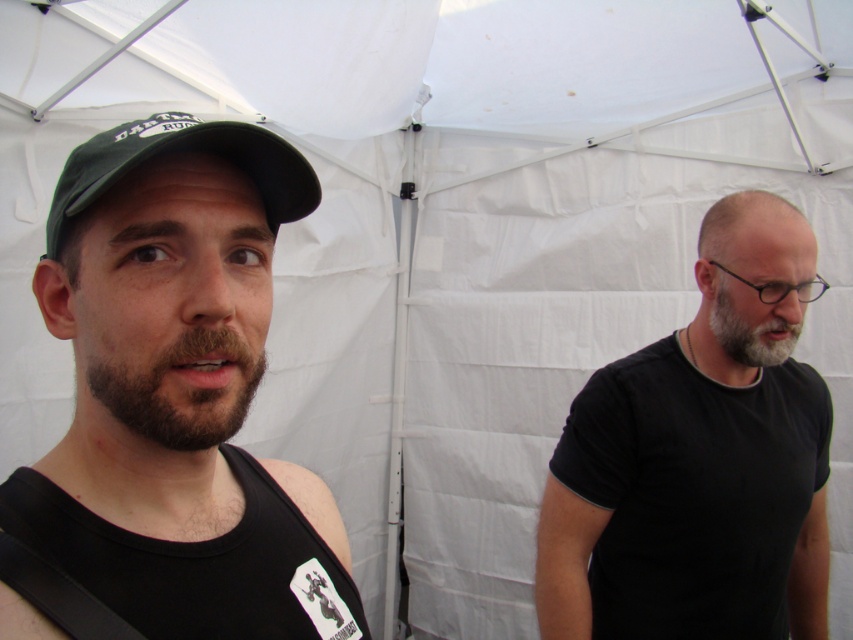
Between black matte cap at upper left and black matte vest at center, which one has less height?

Standing shorter between the two is black matte vest at center.

Does black matte cap at upper left have a lesser height compared to black matte vest at center?

No.

Is point (143, 513) more distant than point (252, 568)?

No, (143, 513) is closer to viewer.

Identify the location of black matte cap at upper left. The width and height of the screenshot is (853, 640). point(170,403).

Does black matte vest at center have a smaller size compared to gray matte beard at center?

No, black matte vest at center is not smaller than gray matte beard at center.

Who is higher up, black matte vest at center or gray matte beard at center?

gray matte beard at center is higher up.

Is point (3, 499) less distant than point (752, 365)?

That is True.

Locate an element on the screen. black matte vest at center is located at coordinates (195, 564).

Is black matte t-shirt at right shorter than black matte vest at center?

Incorrect, black matte t-shirt at right's height does not fall short of black matte vest at center's.

Is point (784, 296) positioned before point (300, 534)?

No.

Find the location of a particular element. black matte t-shirt at right is located at coordinates (698, 456).